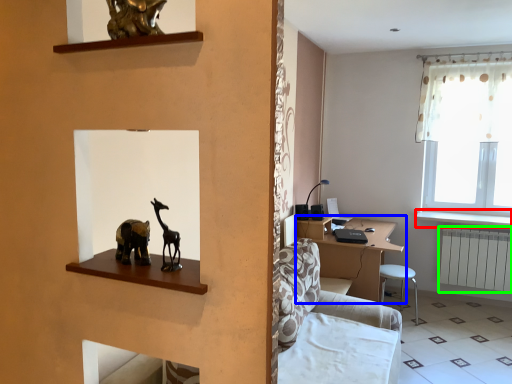
Question: Estimate the real-world distances between objects in this image. Which object is farther from window sill (highlighted by a red box), table (highlighted by a blue box) or radiator (highlighted by a green box)?

Choices:
 (A) table
 (B) radiator

Answer: (A)